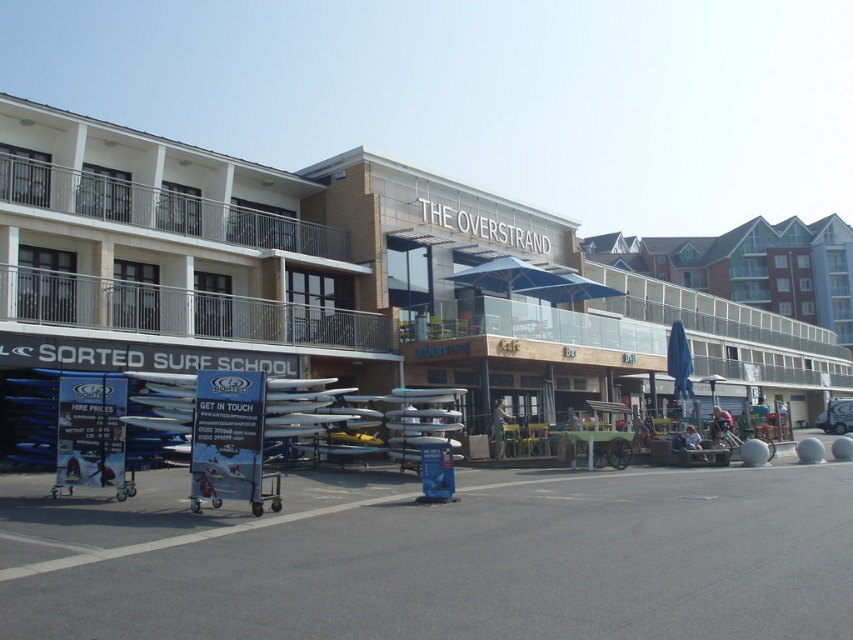
Between beige brick building at center and blue fabric umbrella at center, which one has more height?

With more height is beige brick building at center.

Does beige brick building at center have a lesser width compared to blue fabric umbrella at center?

Incorrect, beige brick building at center's width is not less than blue fabric umbrella at center's.

Is point (1, 305) positioned after point (666, 360)?

No, (1, 305) is in front of (666, 360).

Identify the location of beige brick building at center. (338, 276).